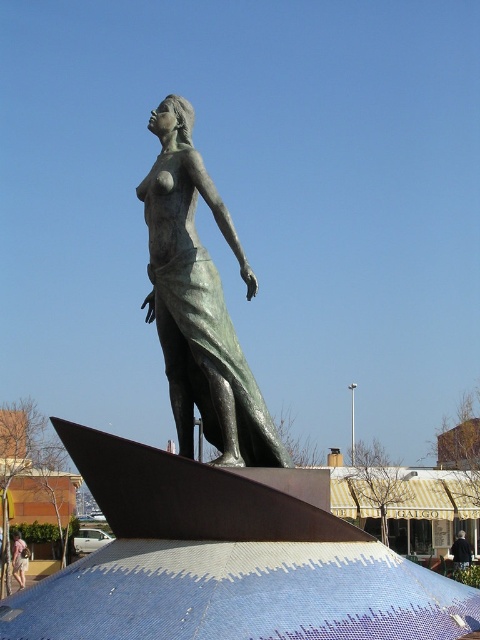
Does point (207, 378) come farther from viewer compared to point (22, 556)?

That is False.

Does point (205, 177) come closer to viewer compared to point (27, 554)?

Yes, point (205, 177) is in front of point (27, 554).

Which is in front, point (183, 104) or point (20, 579)?

Point (183, 104) is more forward.

This screenshot has height=640, width=480. What are the coordinates of `green patina bronze statue at center` in the screenshot? It's located at (199, 304).

Who is taller, light pink fabric dress at lower left or black fabric coat at lower right?

light pink fabric dress at lower left

Between light pink fabric dress at lower left and black fabric coat at lower right, which one appears on the left side from the viewer's perspective?

light pink fabric dress at lower left is more to the left.

Is point (27, 557) positioned behind point (468, 561)?

No.

This screenshot has width=480, height=640. What are the coordinates of `light pink fabric dress at lower left` in the screenshot? It's located at (20, 557).

Identify the location of green patina bronze statue at center. Image resolution: width=480 pixels, height=640 pixels. (199, 304).

Is the position of green patina bronze statue at center more distant than that of black fabric coat at lower right?

No, green patina bronze statue at center is closer to the viewer.

Is point (170, 310) more distant than point (468, 548)?

No, (170, 310) is in front of (468, 548).

Identify the location of green patina bronze statue at center. The height and width of the screenshot is (640, 480). (199, 304).